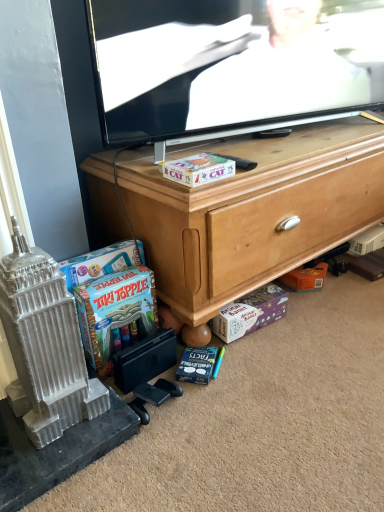
Image resolution: width=384 pixels, height=512 pixels. What do you see at coordinates (114, 312) in the screenshot? I see `blue cardboard game at lower left, positioned as the first cash in left-to-right order` at bounding box center [114, 312].

Where is `flat screen tv at upper center`? The width and height of the screenshot is (384, 512). flat screen tv at upper center is located at coordinates (218, 66).

Locate an element on the screen. The width and height of the screenshot is (384, 512). purple cardboard box at lower center, acting as the third cash starting from the top is located at coordinates (250, 313).

The width and height of the screenshot is (384, 512). What do you see at coordinates (251, 213) in the screenshot? I see `wooden cabinet at center` at bounding box center [251, 213].

You are a GUI agent. You are given a task and a screenshot of the screen. Output one action in this format:
    pyautogui.click(x=<x>, y=<y>)
    Task: Click on the blue cardboard game at lower left, the 3th cash when ordered from right to left
    This screenshot has width=384, height=512.
    Given the screenshot: What is the action you would take?
    pyautogui.click(x=114, y=312)

Are purple cardboard box at lower center, acting as the third cash starting from the top, and blue cardboard game at lower left, the 3th cash when ordered from right to left, making contact?

No, purple cardboard box at lower center, acting as the third cash starting from the top, is not beside blue cardboard game at lower left, the 3th cash when ordered from right to left.

From the image's perspective, is purple cardboard box at lower center, which is the 1th cash from right to left, below blue cardboard game at lower left, arranged as the second cash when viewed from the top?

Yes, from the image's perspective, purple cardboard box at lower center, which is the 1th cash from right to left, is below blue cardboard game at lower left, arranged as the second cash when viewed from the top.

Is blue cardboard game at lower left, positioned as the first cash in left-to-right order, located within purple cardboard box at lower center, which is the first cash from bottom to top?

Definitely not — blue cardboard game at lower left, positioned as the first cash in left-to-right order, is not inside purple cardboard box at lower center, which is the first cash from bottom to top.

Is purple cardboard box at lower center, which is the first cash from bottom to top, in front of or behind blue cardboard game at lower left, the 3th cash when ordered from right to left, in the image?

Clearly, purple cardboard box at lower center, which is the first cash from bottom to top, is behind blue cardboard game at lower left, the 3th cash when ordered from right to left.

Is wooden cabinet at center aimed at flat screen tv at upper center?

No, wooden cabinet at center is not turned towards flat screen tv at upper center.

Which object is further away from the camera, wooden cabinet at center or flat screen tv at upper center?

flat screen tv at upper center is further from the camera.

Considering the relative sizes of wooden cabinet at center and flat screen tv at upper center in the image provided, is wooden cabinet at center bigger than flat screen tv at upper center?

Yes.

Looking at this image, from the image's perspective, is wooden cabinet at center located above or below blue cardboard game at lower left, the 3th cash when ordered from right to left?

wooden cabinet at center is above blue cardboard game at lower left, the 3th cash when ordered from right to left.

From a real-world perspective, between wooden cabinet at center and blue cardboard game at lower left, arranged as the second cash when viewed from the top, who is vertically lower?

blue cardboard game at lower left, arranged as the second cash when viewed from the top, is physically lower.

Who is bigger, wooden cabinet at center or blue cardboard game at lower left, the 3th cash when ordered from right to left?

wooden cabinet at center.

Is wooden cabinet at center far from blue cardboard game at lower left, positioned as the first cash in left-to-right order?

No.

Is blue cardboard game at lower left, which is the second cash in bottom-to-top order, turned away from flat screen tv at upper center?

That's not correct — blue cardboard game at lower left, which is the second cash in bottom-to-top order, is not looking away from flat screen tv at upper center.

From the image's perspective, which is above, blue cardboard game at lower left, the 3th cash when ordered from right to left, or flat screen tv at upper center?

From the image's view, flat screen tv at upper center is above.

In the image, is blue cardboard game at lower left, arranged as the second cash when viewed from the top, positioned in front of or behind flat screen tv at upper center?

Visually, blue cardboard game at lower left, arranged as the second cash when viewed from the top, is located behind flat screen tv at upper center.

Is matte cardboard box at center, which is counted as the 3th cash, starting from the bottom, with flat screen tv at upper center?

No, matte cardboard box at center, which is counted as the 3th cash, starting from the bottom, is not in contact with flat screen tv at upper center.

From the image's perspective, is matte cardboard box at center, which is counted as the 3th cash, starting from the bottom, below flat screen tv at upper center?

Yes, from the image's perspective, matte cardboard box at center, which is counted as the 3th cash, starting from the bottom, is beneath flat screen tv at upper center.

From their relative heights in the image, would you say matte cardboard box at center, the first cash when ordered from top to bottom, is taller or shorter than flat screen tv at upper center?

Considering their sizes, matte cardboard box at center, the first cash when ordered from top to bottom, has less height than flat screen tv at upper center.

Is the depth of matte cardboard box at center, which is counted as the 3th cash, starting from the bottom, less than that of flat screen tv at upper center?

No, it is behind flat screen tv at upper center.

From the picture: From a real-world perspective, is purple cardboard box at lower center, which is the 1th cash from right to left, positioned above or below matte cardboard box at center, which is counted as the 3th cash, starting from the bottom?

purple cardboard box at lower center, which is the 1th cash from right to left, is situated lower than matte cardboard box at center, which is counted as the 3th cash, starting from the bottom, in the real world.

Consider the image. Is there a large distance between purple cardboard box at lower center, which is the 1th cash from right to left, and matte cardboard box at center, which is counted as the 3th cash, starting from the bottom?

No.

Could you tell me if purple cardboard box at lower center, acting as the third cash starting from the top, is facing matte cardboard box at center, which appears as the 2th cash when viewed from the right?

No, purple cardboard box at lower center, acting as the third cash starting from the top, is not turned towards matte cardboard box at center, which appears as the 2th cash when viewed from the right.

Identify the location of cash that appears on the right of matte cardboard box at center, which is counted as the 3th cash, starting from the bottom. This screenshot has height=512, width=384. (250, 313).

Is matte cardboard box at center, positioned as the second cash in left-to-right order, taller or shorter than black plastic remote control at center?

Considering their sizes, matte cardboard box at center, positioned as the second cash in left-to-right order, has more height than black plastic remote control at center.

Does matte cardboard box at center, which is counted as the 3th cash, starting from the bottom, have a lesser width compared to black plastic remote control at center?

Correct, the width of matte cardboard box at center, which is counted as the 3th cash, starting from the bottom, is less than that of black plastic remote control at center.

Is matte cardboard box at center, which appears as the 2th cash when viewed from the right, not near black plastic remote control at center?

No.

The width and height of the screenshot is (384, 512). Identify the location of cash that is behind the blue cardboard game at lower left, which is the second cash in bottom-to-top order. (250, 313).

There is a wooden cabinet at center. What are the coordinates of `television above it (from a real-world perspective)` in the screenshot? It's located at point(218,66).

From the image, which object appears to be farther from flat screen tv at upper center, blue matte book at lower center or wooden cabinet at center?

blue matte book at lower center is further to flat screen tv at upper center.

Based on their spatial positions, is wooden cabinet at center or blue cardboard game at lower left, the 3th cash when ordered from right to left, closer to flat screen tv at upper center?

wooden cabinet at center is positioned closer to the anchor flat screen tv at upper center.

Looking at the image, which one is located further to flat screen tv at upper center, purple cardboard box at lower center, the 3th cash positioned from the left, or matte cardboard box at center, which appears as the 2th cash when viewed from the right?

purple cardboard box at lower center, the 3th cash positioned from the left, is further to flat screen tv at upper center.

From the image, which object appears to be nearer to purple cardboard box at lower center, acting as the third cash starting from the top, blue matte book at lower center or wooden cabinet at center?

The object closer to purple cardboard box at lower center, acting as the third cash starting from the top, is blue matte book at lower center.

Considering their positions, is black plastic remote control at center positioned closer to blue matte book at lower center than blue cardboard game at lower left, arranged as the second cash when viewed from the top?

blue cardboard game at lower left, arranged as the second cash when viewed from the top.

Estimate the real-world distances between objects in this image. Which object is closer to wooden cabinet at center, matte cardboard box at center, positioned as the second cash in left-to-right order, or flat screen tv at upper center?

The object closer to wooden cabinet at center is flat screen tv at upper center.

Based on their spatial positions, is blue matte book at lower center or purple cardboard box at lower center, which is the 1th cash from right to left, closer to wooden cabinet at center?

purple cardboard box at lower center, which is the 1th cash from right to left, is positioned closer to the anchor wooden cabinet at center.

Looking at the image, which one is located closer to blue cardboard game at lower left, arranged as the second cash when viewed from the top, black plastic remote control at center or wooden cabinet at center?

Among the two, wooden cabinet at center is located nearer to blue cardboard game at lower left, arranged as the second cash when viewed from the top.

At what (x,y) coordinates should I click in order to perform the action: click on cabinetry between flat screen tv at upper center and matte cardboard box at center, which is counted as the 3th cash, starting from the bottom, in the up-down direction. Please return your answer as a coordinate pair (x, y). The width and height of the screenshot is (384, 512). Looking at the image, I should click on (251, 213).

Locate an element on the screen. Image resolution: width=384 pixels, height=512 pixels. cabinetry between flat screen tv at upper center and purple cardboard box at lower center, which is the first cash from bottom to top, from top to bottom is located at coordinates (251, 213).

The width and height of the screenshot is (384, 512). Identify the location of cash between black plastic remote control at center and blue cardboard game at lower left, which is the second cash in bottom-to-top order, in the vertical direction. (198, 169).

The width and height of the screenshot is (384, 512). Identify the location of remote control between flat screen tv at upper center and purple cardboard box at lower center, acting as the third cash starting from the top, in the vertical direction. (240, 162).